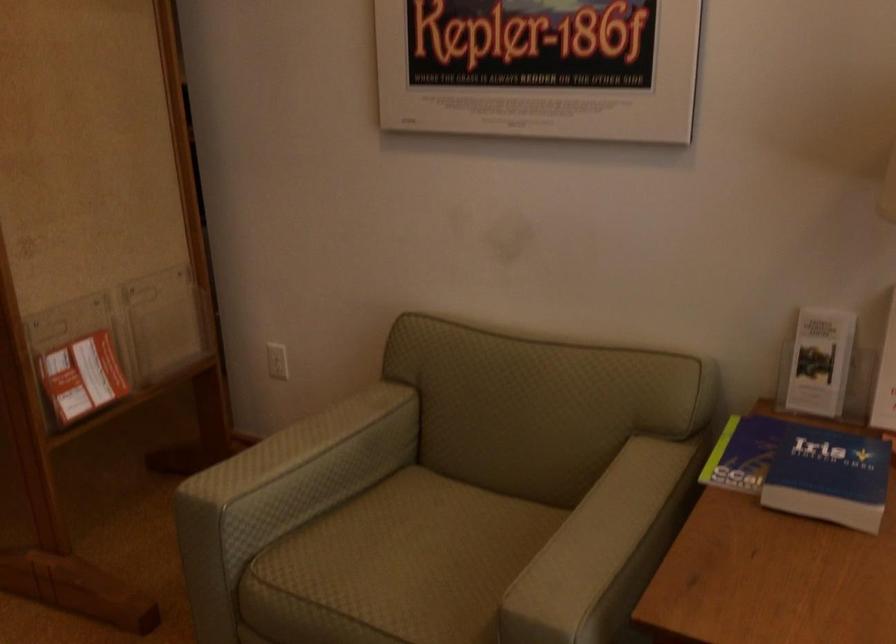
You are a GUI agent. You are given a task and a screenshot of the screen. Output one action in this format:
    pyautogui.click(x=<x>, y=<y>)
    Task: Click on the white light switch
    
    Given the screenshot: What is the action you would take?
    click(x=277, y=361)